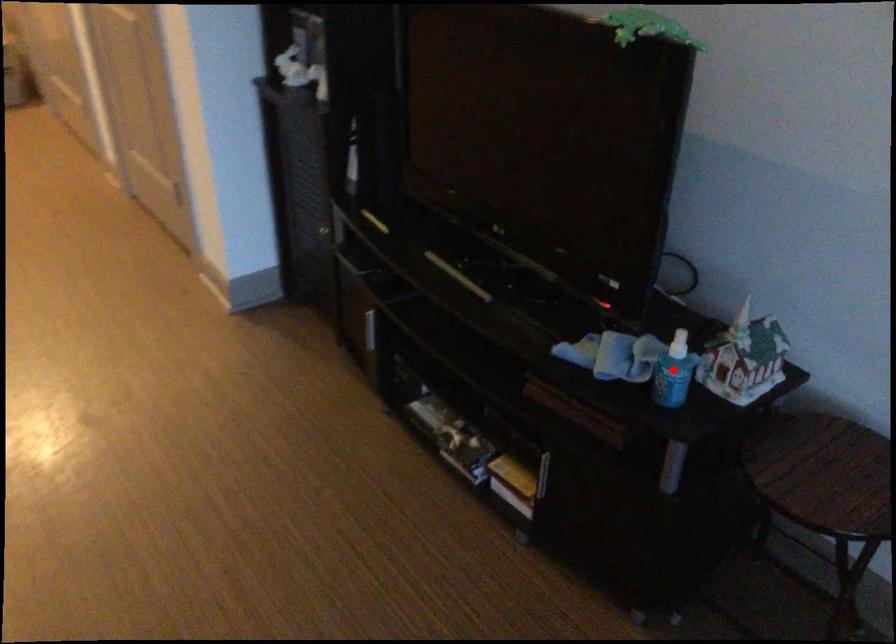
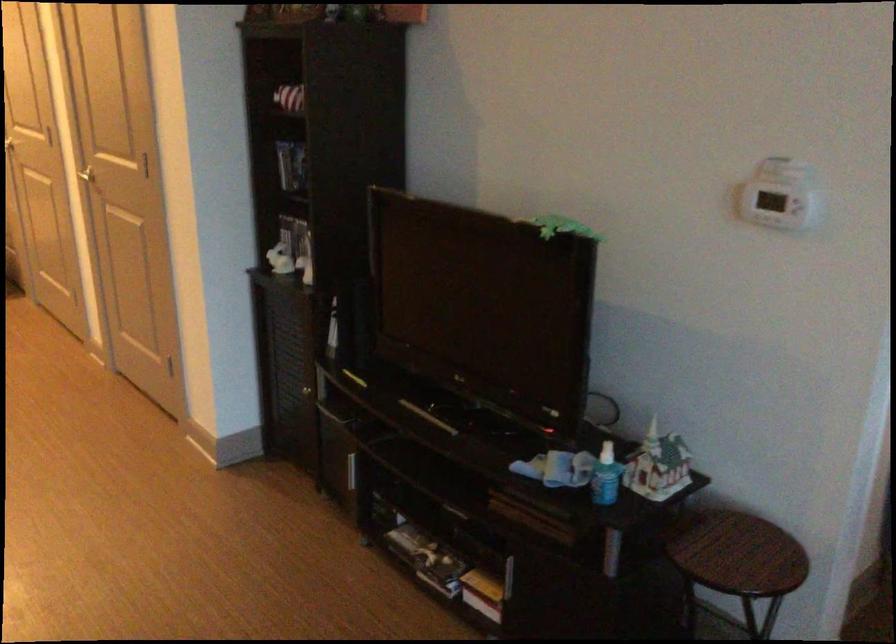
The point at the highlighted location is marked in the first image. Where is the corresponding point in the second image?

(606, 476)